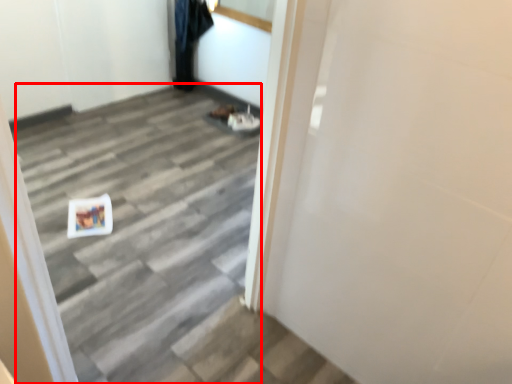
Question: In this image, where is stairwell (annotated by the red box) located relative to garment?

Choices:
 (A) left
 (B) right

Answer: (B)